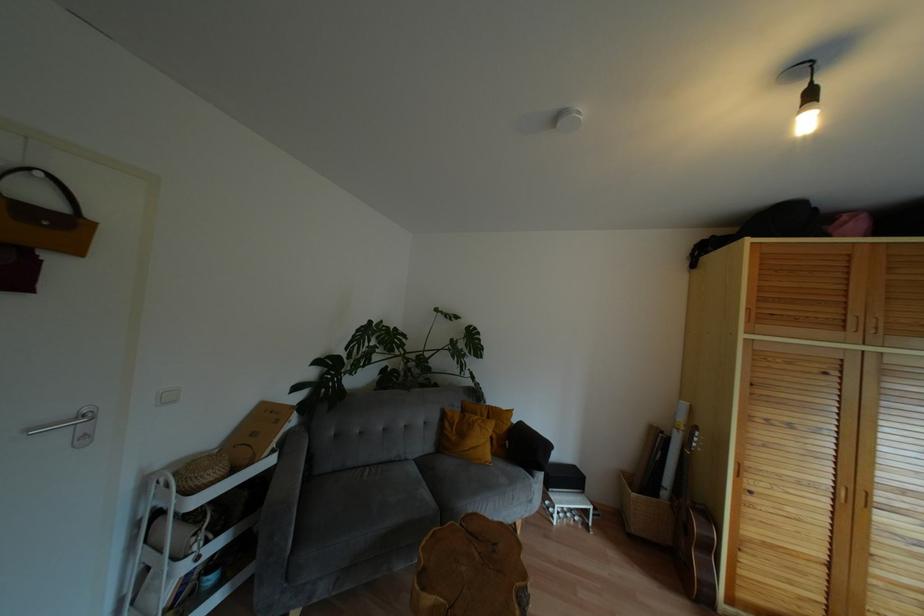
Image resolution: width=924 pixels, height=616 pixels. What do you see at coordinates (370, 488) in the screenshot?
I see `a grey sofa sitting surface` at bounding box center [370, 488].